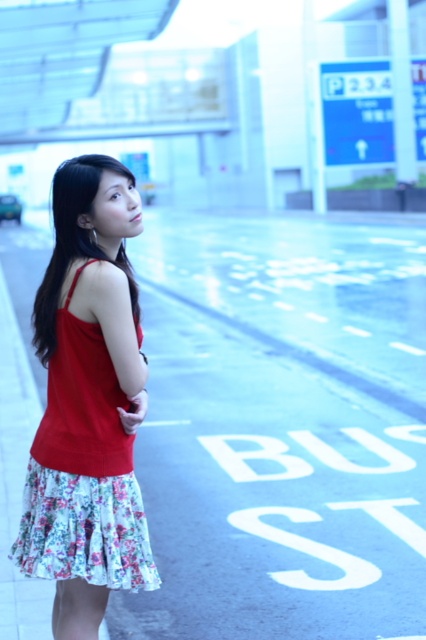
Question: Considering the relative positions of blue asphalt pavement at center and red floral dress at center in the image provided, where is blue asphalt pavement at center located with respect to red floral dress at center?

Choices:
 (A) above
 (B) below

Answer: (A)

Question: Is blue asphalt pavement at center to the right of red floral dress at center from the viewer's perspective?

Choices:
 (A) no
 (B) yes

Answer: (B)

Question: Which of the following is the closest to the observer?

Choices:
 (A) red floral dress at center
 (B) blue asphalt pavement at center

Answer: (A)

Question: Can you confirm if blue asphalt pavement at center is bigger than red floral dress at center?

Choices:
 (A) yes
 (B) no

Answer: (A)

Question: Which of the following is the farthest from the observer?

Choices:
 (A) (91, 227)
 (B) (244, 422)

Answer: (B)